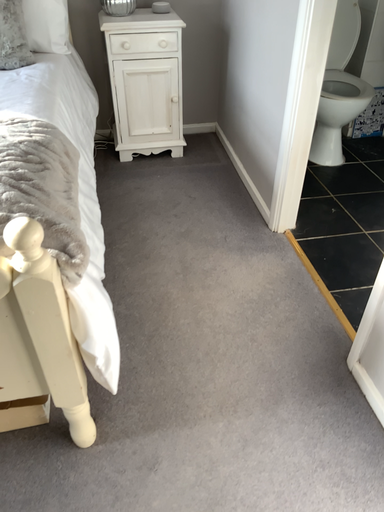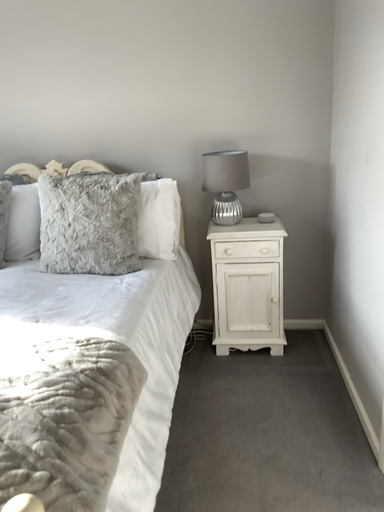
Question: Which way did the camera rotate in the video?

Choices:
 (A) rotated upward
 (B) rotated downward

Answer: (A)